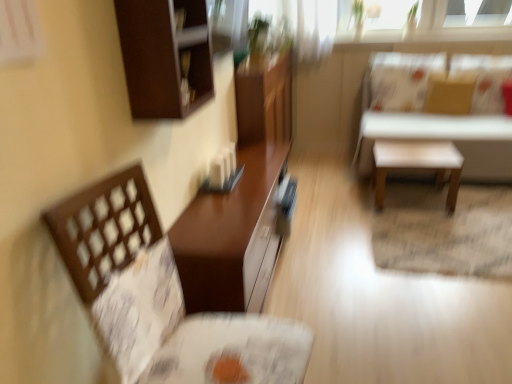
This screenshot has width=512, height=384. What are the coordinates of `free space below dark brown wood cabinet at upper left (from a real-world perspective)` in the screenshot? It's located at (193, 219).